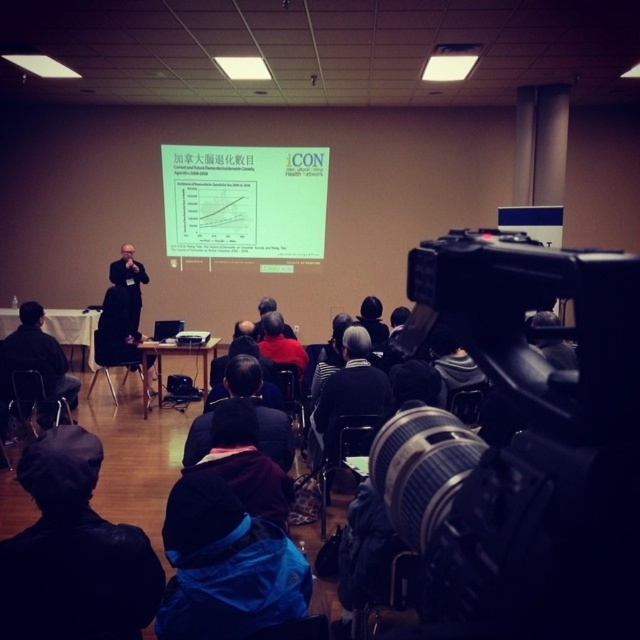
Question: Can you confirm if blue fabric jacket at lower center is positioned to the right of dark gray suit at left?

Choices:
 (A) yes
 (B) no

Answer: (A)

Question: Which point appears farthest from the camera in this image?

Choices:
 (A) (54, 412)
 (B) (528, 419)
 (C) (364, 298)
 (D) (120, 282)

Answer: (C)

Question: Does blue fabric jacket at lower center lie in front of red cotton sweater at center?

Choices:
 (A) yes
 (B) no

Answer: (A)

Question: Which object appears farthest from the camera in this image?

Choices:
 (A) black matte suit at center
 (B) blue fabric jacket at lower center
 (C) dark gray knit cap at center

Answer: (A)

Question: Where is white paper at center located in relation to dark brown fabric jacket at center in the image?

Choices:
 (A) left
 (B) right

Answer: (A)

Question: Which object is farther from the camera taking this photo?

Choices:
 (A) dark gray suit at left
 (B) red cotton sweater at center
 (C) blue fabric jacket at lower center

Answer: (A)